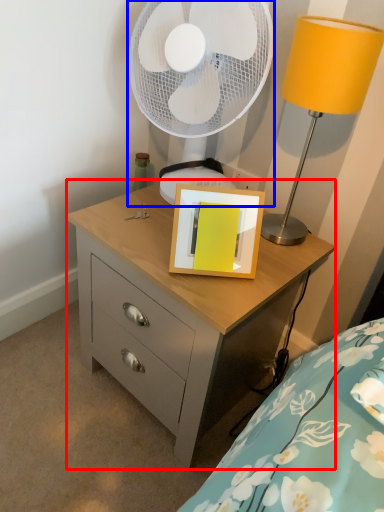
Question: Which object is closer to the camera taking this photo, chest of drawers (highlighted by a red box) or mechanical fan (highlighted by a blue box)?

Choices:
 (A) chest of drawers
 (B) mechanical fan

Answer: (A)